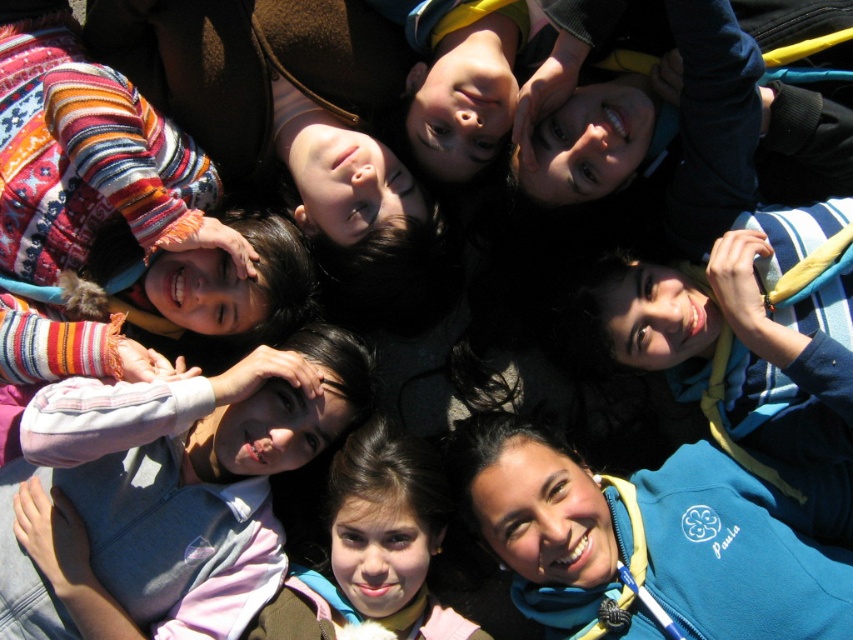
You are a photographer trying to capture a candid shot of the brown hair at center without the light blue denim jacket at center blocking the view. Is the jacket currently blocking the hair?

The light blue denim jacket at center is located above brown hair at center, so yes, the jacket is blocking the view of the brown hair at center.

You are a photographer who wants to take a picture of the light blue denim jacket at center. Where exactly should you focus your camera to capture it?

You should focus your camera at point 0.772 on the x axis and 0.195 on the y axis to capture the light blue denim jacket at center.

You are a photographer who wants to adjust the lighting so that the brown hair at center is visible without being blocked by the light blue denim jacket at center. What should you do?

The light blue denim jacket at center is in front of brown hair at center. To make the brown hair at center visible, you can move the light blue denim jacket at center backward or adjust its position so it no longer blocks the brown hair at center.